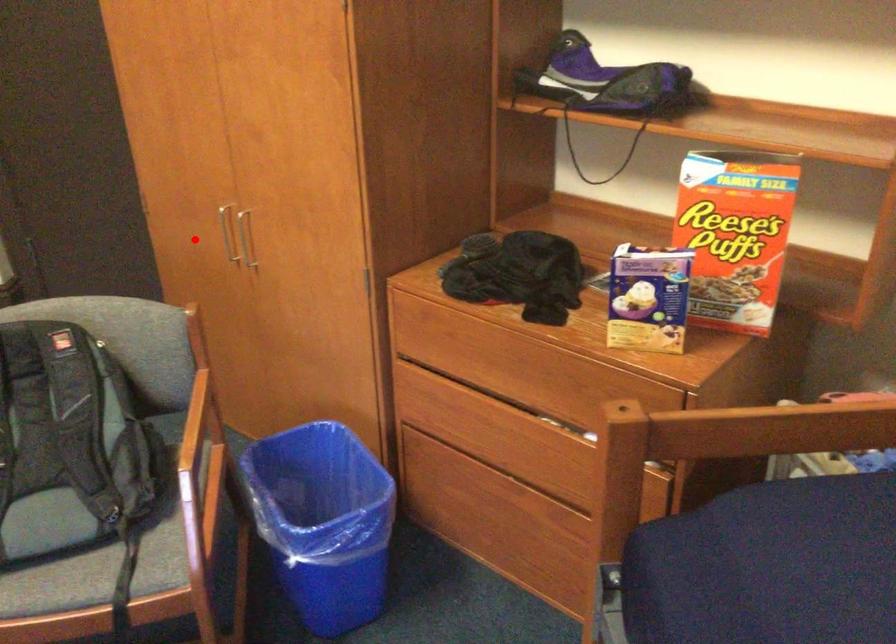
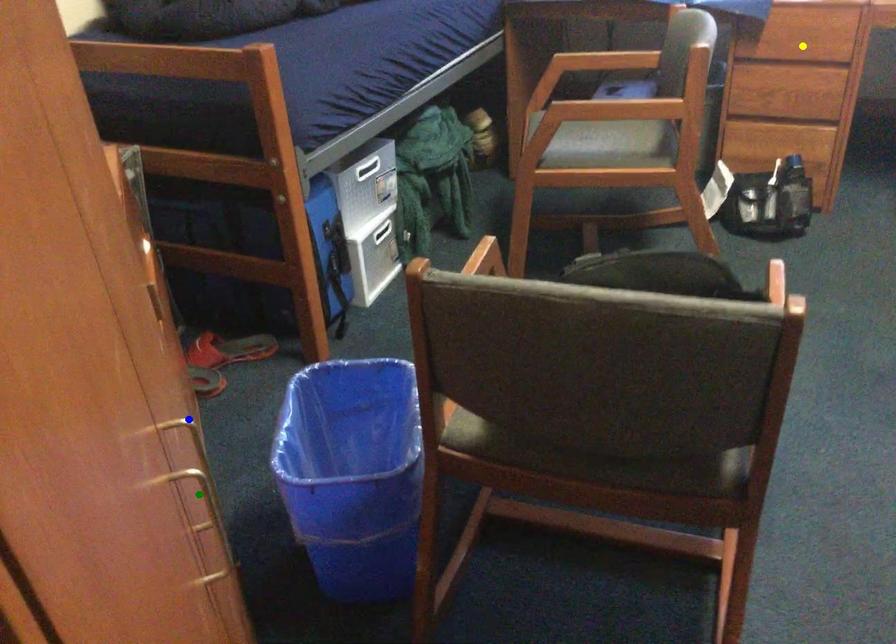
Question: I am providing you with two images of the same scene from different viewpoints. A red point is marked on the first image. You are given multiple points on the second image. In image 2, which mark is for the same physical point as the one in image 1?

Choices:
 (A) yellow point
 (B) blue point
 (C) green point

Answer: (C)